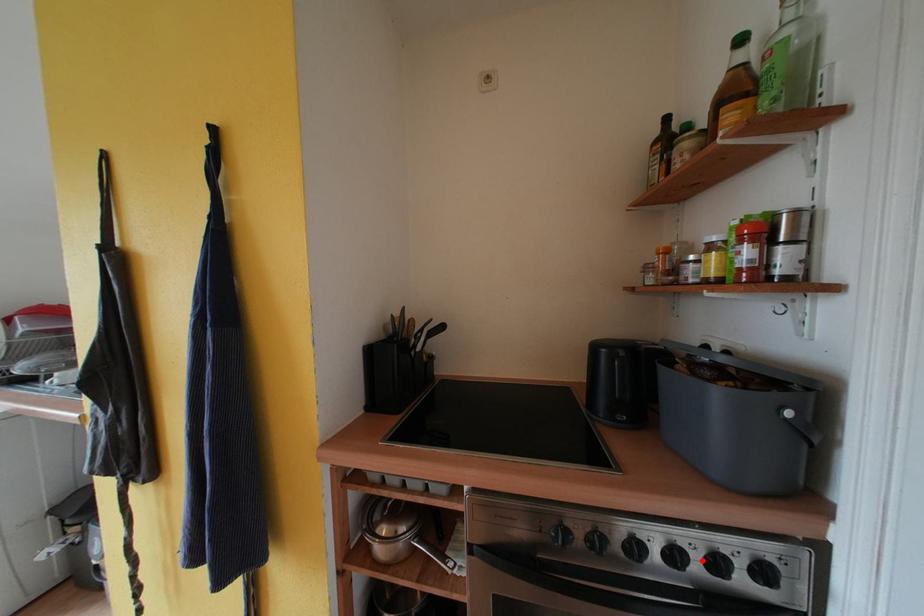
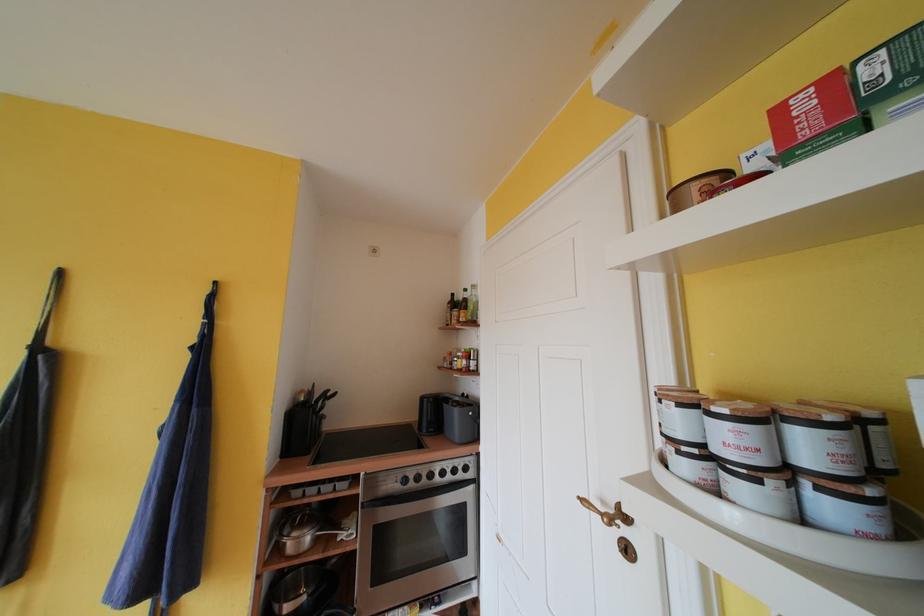
Question: I am providing you with two images of the same scene from different viewpoints. In image1, a red point is highlighted. Considering the same 3D point in image2, which of the following is correct?

Choices:
 (A) It is closer
 (B) It is farther

Answer: (B)